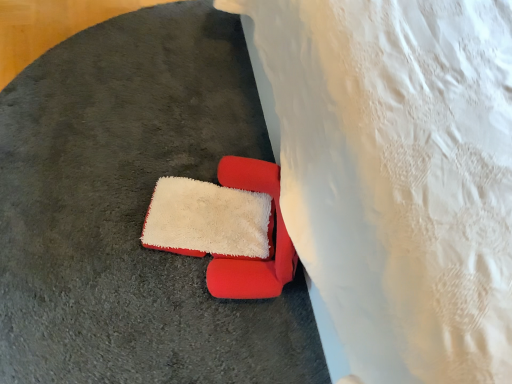
Question: Considering the relative positions of white lace bedsheet at lower right and velvet red chair at center in the image provided, is white lace bedsheet at lower right to the left of velvet red chair at center from the viewer's perspective?

Choices:
 (A) no
 (B) yes

Answer: (A)

Question: Considering the relative sizes of white lace bedsheet at lower right and velvet red chair at center in the image provided, is white lace bedsheet at lower right bigger than velvet red chair at center?

Choices:
 (A) yes
 (B) no

Answer: (A)

Question: Would you consider white lace bedsheet at lower right to be distant from velvet red chair at center?

Choices:
 (A) no
 (B) yes

Answer: (A)

Question: Is velvet red chair at center surrounded by white lace bedsheet at lower right?

Choices:
 (A) no
 (B) yes

Answer: (A)

Question: Can you confirm if white lace bedsheet at lower right is smaller than velvet red chair at center?

Choices:
 (A) yes
 (B) no

Answer: (B)

Question: Does white lace bedsheet at lower right lie behind velvet red chair at center?

Choices:
 (A) yes
 (B) no

Answer: (B)

Question: From a real-world perspective, is velvet red chair at center positioned under white lace bedsheet at lower right based on gravity?

Choices:
 (A) no
 (B) yes

Answer: (B)

Question: Does velvet red chair at center have a larger size compared to white lace bedsheet at lower right?

Choices:
 (A) no
 (B) yes

Answer: (A)

Question: Can you confirm if velvet red chair at center is wider than white lace bedsheet at lower right?

Choices:
 (A) yes
 (B) no

Answer: (B)

Question: From the image's perspective, is velvet red chair at center located beneath white lace bedsheet at lower right?

Choices:
 (A) no
 (B) yes

Answer: (B)

Question: Would you say velvet red chair at center is outside white lace bedsheet at lower right?

Choices:
 (A) no
 (B) yes

Answer: (B)

Question: Does velvet red chair at center turn towards white lace bedsheet at lower right?

Choices:
 (A) yes
 (B) no

Answer: (B)

Question: From the image's perspective, is white lace bedsheet at lower right above or below velvet red chair at center?

Choices:
 (A) above
 (B) below

Answer: (A)